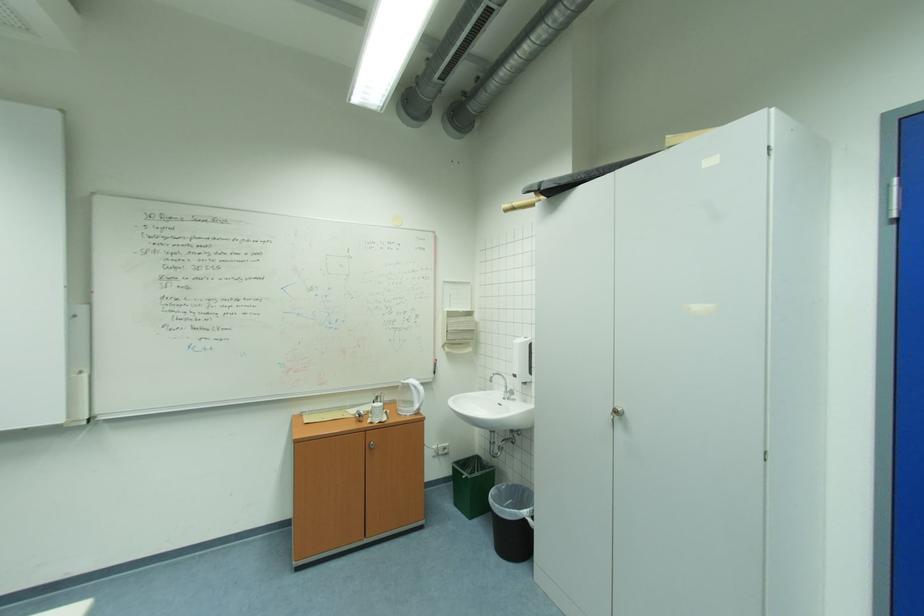
The location [521,360] corresponds to which object?

This point indicates the white soap dispenser.